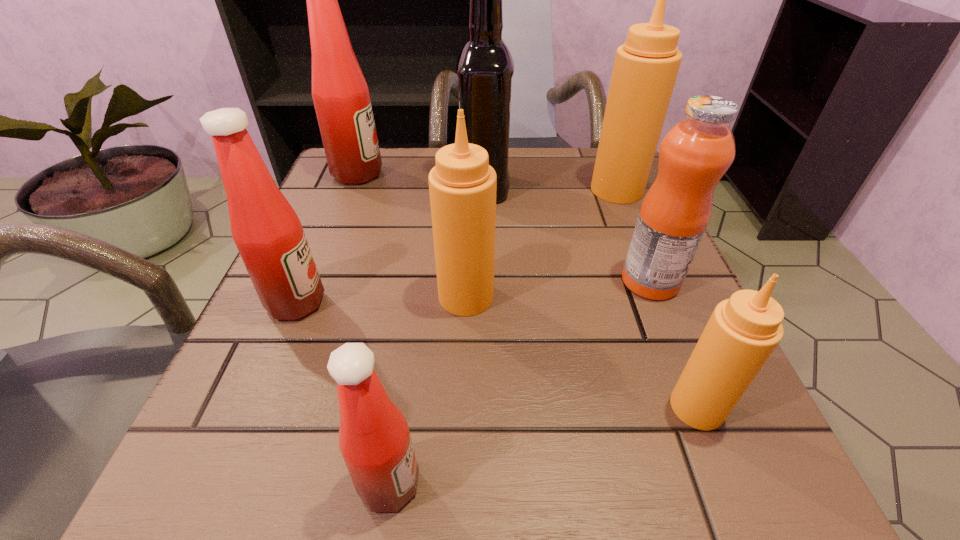
The image size is (960, 540). What are the coordinates of `free space at the near left corner of the desktop` in the screenshot? It's located at (286, 507).

This screenshot has height=540, width=960. In the image, there is a desktop. Identify the location of vacant space at the far right corner. (635, 204).

Locate an element on the screen. vacant space at the near right corner of the desktop is located at coordinates (704, 444).

At what (x,y) coordinates should I click in order to perform the action: click on vacant space in between the liquor and the biggest red condiment. Please return your answer as a coordinate pair (x, y). Looking at the image, I should click on (420, 181).

Locate an element on the screen. This screenshot has width=960, height=540. vacant space in between the second nearest object and the second farthest tan condiment is located at coordinates (582, 352).

I want to click on vacant area between the second nearest object and the second nearest red condiment, so click(496, 355).

This screenshot has height=540, width=960. Identify the location of empty space between the nearest tan condiment and the biggest red condiment. (527, 291).

I want to click on free space that is in between the leftmost tan condiment and the biggest tan condiment, so click(541, 243).

You are a GUI agent. You are given a task and a screenshot of the screen. Output one action in this format:
    pyautogui.click(x=<x>, y=<y>)
    Task: Click on the free space between the biggest red condiment and the liquor
    This screenshot has width=960, height=540.
    Given the screenshot: What is the action you would take?
    pyautogui.click(x=420, y=181)

The width and height of the screenshot is (960, 540). Identify the location of unoccupied area between the biggest red condiment and the second farthest red condiment. (326, 238).